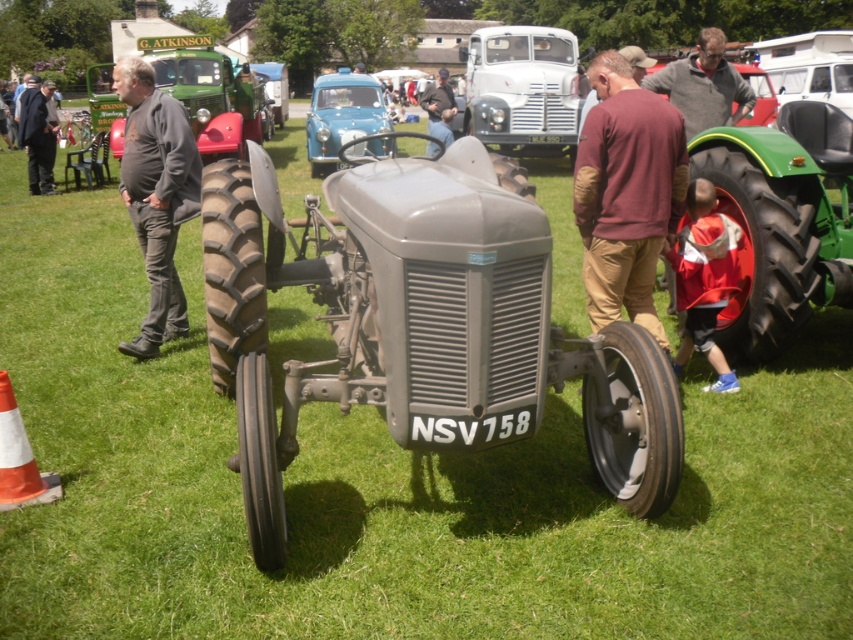
Which is below, maroon sweater at center or dark gray suit at left?

Answer: maroon sweater at center

Is maroon sweater at center above dark gray suit at left?

Incorrect, maroon sweater at center is not positioned above dark gray suit at left.

Between point (657, 106) and point (33, 193), which one is positioned behind?

Point (33, 193)

Where is `maroon sweater at center`? maroon sweater at center is located at coordinates (625, 193).

Can you confirm if maroon sweater at center is positioned to the right of red jacket at center?

Incorrect, maroon sweater at center is not on the right side of red jacket at center.

Who is more forward, (x=605, y=243) or (x=692, y=225)?

Point (x=605, y=243) is in front.

The image size is (853, 640). I want to click on maroon sweater at center, so click(x=625, y=193).

You are a GUI agent. You are given a task and a screenshot of the screen. Output one action in this format:
    pyautogui.click(x=<x>, y=<y>)
    Task: Click on the maroon sweater at center
    This screenshot has height=640, width=853.
    Given the screenshot: What is the action you would take?
    pyautogui.click(x=625, y=193)

Does gray fabric pants at left have a lesser width compared to dark gray suit at left?

Correct, gray fabric pants at left's width is less than dark gray suit at left's.

Can you confirm if gray fabric pants at left is smaller than dark gray suit at left?

Indeed, gray fabric pants at left has a smaller size compared to dark gray suit at left.

What are the coordinates of `gray fabric pants at left` in the screenshot? It's located at (155, 195).